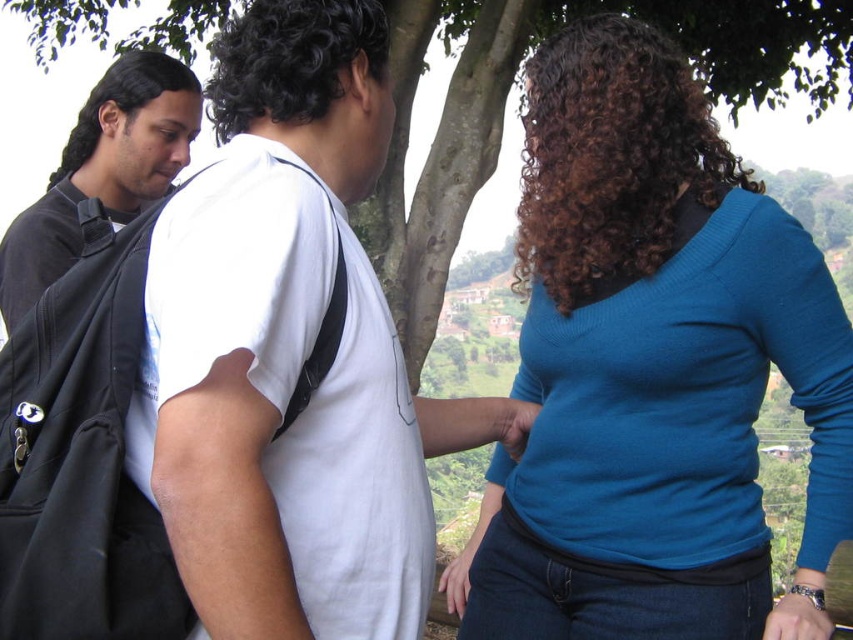
Question: Does blue knit sweater at upper right lie in front of white matte t-shirt at center?

Choices:
 (A) no
 (B) yes

Answer: (A)

Question: Does white matte t-shirt at center appear on the right side of black matte backpack at left?

Choices:
 (A) yes
 (B) no

Answer: (A)

Question: Which point is closer to the camera?

Choices:
 (A) blue knit sweater at upper right
 (B) black matte backpack at left
 (C) white matte t-shirt at center

Answer: (C)

Question: Does blue knit sweater at upper right have a greater width compared to white matte t-shirt at center?

Choices:
 (A) no
 (B) yes

Answer: (B)

Question: Which object is closer to the camera taking this photo?

Choices:
 (A) blue knit sweater at upper right
 (B) black matte backpack at left
 (C) white matte t-shirt at center

Answer: (C)

Question: Which point appears closest to the camera in this image?

Choices:
 (A) (788, 595)
 (B) (160, 138)
 (C) (223, 211)

Answer: (C)